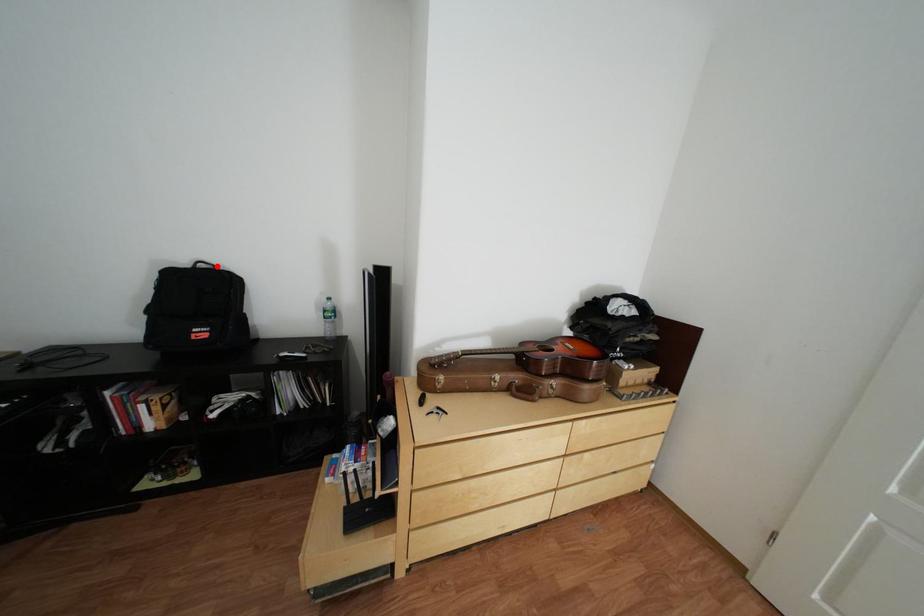
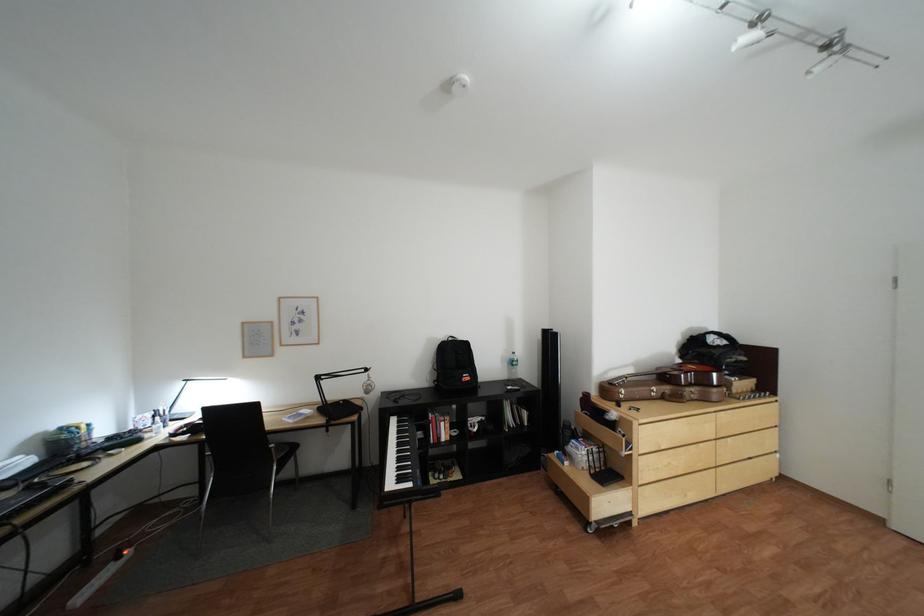
The point at the highlighted location is marked in the first image. Where is the corresponding point in the second image?

(466, 339)